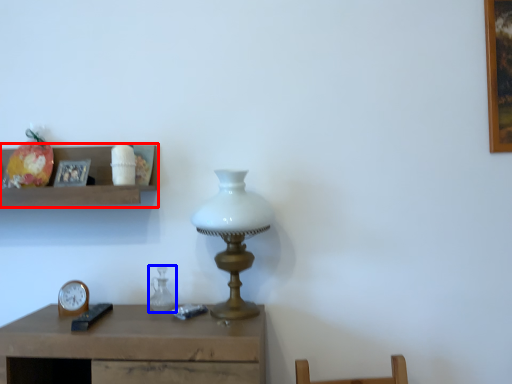
Question: Which object appears closest to the camera in this image, shelf (highlighted by a red box) or glass vase (highlighted by a blue box)?

Choices:
 (A) shelf
 (B) glass vase

Answer: (A)